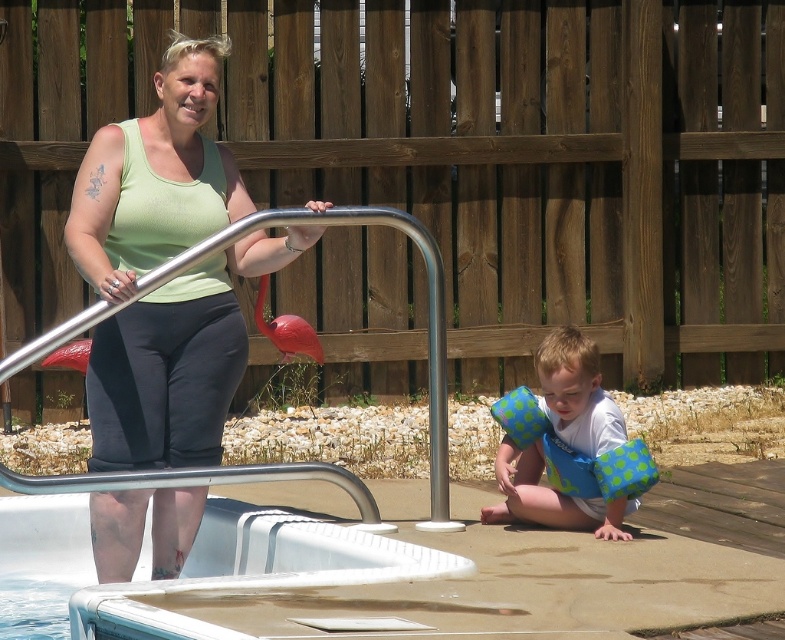
Question: Can you confirm if green matte tank top at upper left is positioned above white fabric shirt at lower right?

Choices:
 (A) yes
 (B) no

Answer: (A)

Question: Which point appears farthest from the camera in this image?

Choices:
 (A) (108, 592)
 (B) (90, 280)
 (C) (433, 333)
 (D) (564, 376)

Answer: (C)

Question: Which of these objects is positioned closest to the white plastic pool at lower left?

Choices:
 (A) green matte tank top at upper left
 (B) white fabric shirt at lower right

Answer: (A)

Question: Where is white plastic pool at lower left located in relation to white fabric shirt at lower right in the image?

Choices:
 (A) below
 (B) above

Answer: (A)

Question: Can you confirm if green matte tank top at upper left is wider than white plastic pool at lower left?

Choices:
 (A) yes
 (B) no

Answer: (B)

Question: Which of the following is the farthest from the observer?

Choices:
 (A) [411, 577]
 (B) [126, 332]

Answer: (B)